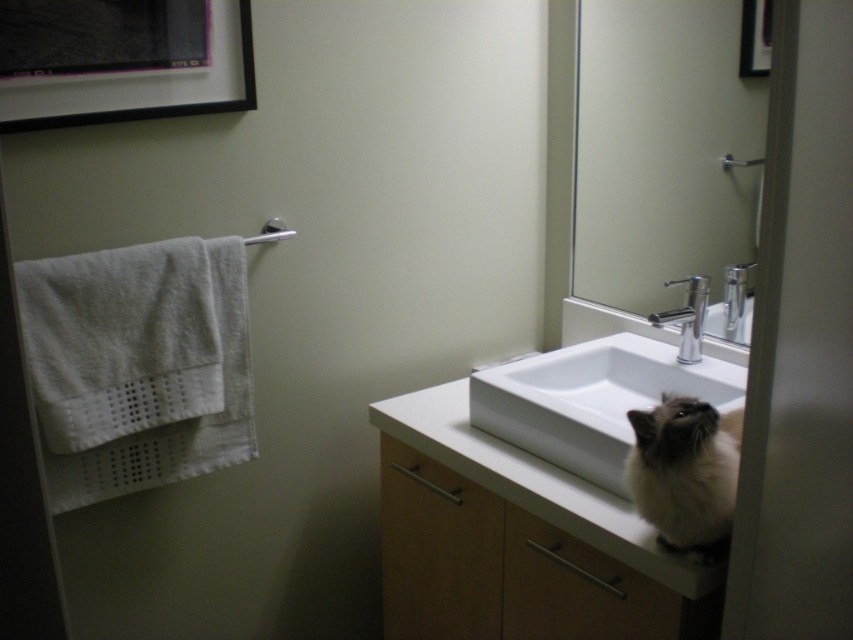
This screenshot has height=640, width=853. What do you see at coordinates (662, 150) in the screenshot?
I see `clear glass mirror at upper center` at bounding box center [662, 150].

Which is more to the left, clear glass mirror at upper center or white fluffy cat at lower right?

white fluffy cat at lower right is more to the left.

Identify the location of clear glass mirror at upper center. (662, 150).

Between white matte sink at center and silver metallic towel bar at upper left, which one appears on the left side from the viewer's perspective?

silver metallic towel bar at upper left

Does white matte sink at center have a greater width compared to silver metallic towel bar at upper left?

Indeed, white matte sink at center has a greater width compared to silver metallic towel bar at upper left.

Between point (485, 474) and point (288, 236), which one is positioned in front?

Point (485, 474)

At what (x,y) coordinates should I click in order to perform the action: click on white matte sink at center. Please return your answer as a coordinate pair (x, y). Looking at the image, I should click on (517, 541).

Is black glossy picture frame at upper right in front of silver metallic faucet at upper right?

Yes, black glossy picture frame at upper right is in front of silver metallic faucet at upper right.

Who is more forward, (740, 58) or (726, 314)?

Point (740, 58)

What are the coordinates of `black glossy picture frame at upper right` in the screenshot? It's located at (755, 36).